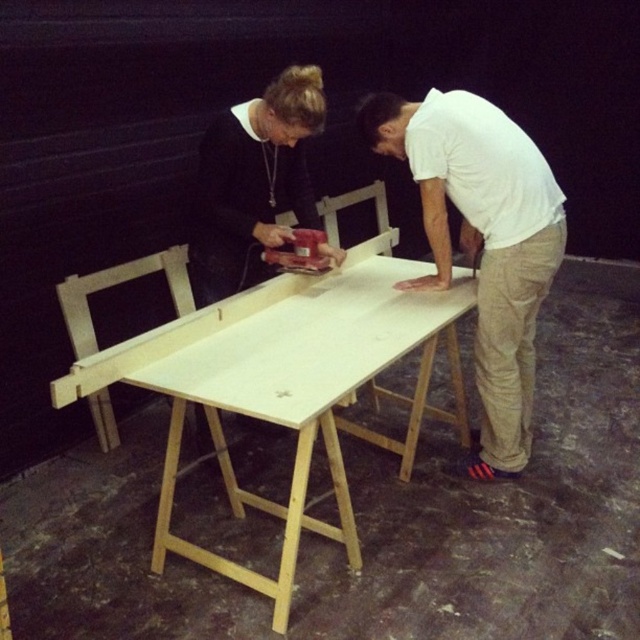
Who is more forward, [77,365] or [205,225]?

Point [77,365] is in front.

Is point (284, 596) closer to camera compared to point (282, 160)?

Yes, it is.

Who is more distant from viewer, (426,305) or (211,252)?

The point (211,252) is behind.

Identify the location of white matte wood table at center. (285, 385).

Can you confirm if white cotton shirt at center is shorter than white matte shirt at upper center?

Incorrect, white cotton shirt at center's height does not fall short of white matte shirt at upper center's.

Who is higher up, white cotton shirt at center or white matte shirt at upper center?

Positioned higher is white matte shirt at upper center.

Who is more distant from viewer, (502, 134) or (241, 163)?

Positioned behind is point (241, 163).

Locate an element on the screen. This screenshot has height=640, width=640. white cotton shirt at center is located at coordinates (483, 241).

Can you confirm if white matte wood table at center is smaller than white cotton shirt at center?

Actually, white matte wood table at center might be larger than white cotton shirt at center.

Who is lower down, white matte wood table at center or white cotton shirt at center?

white matte wood table at center

Measure the distance between white matte wood table at center and camera.

They are 1.69 meters apart.

Image resolution: width=640 pixels, height=640 pixels. I want to click on white matte wood table at center, so click(285, 385).